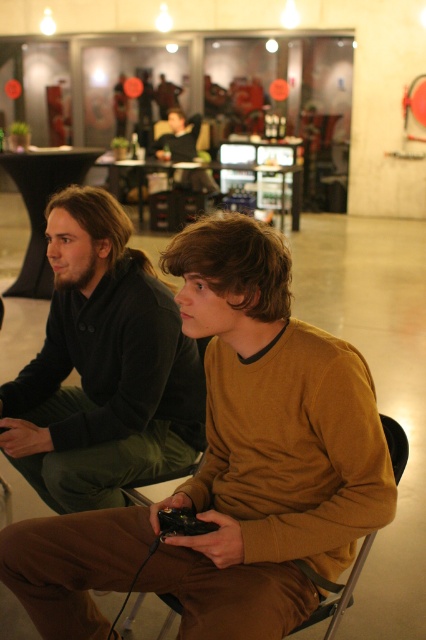
What do you see at coordinates (232, 467) in the screenshot?
I see `brown cotton shirt at center` at bounding box center [232, 467].

Locate an element on the screen. The image size is (426, 640). brown cotton shirt at center is located at coordinates (232, 467).

Between brown matte sweater at center and metallic silver chair at center, which one has less height?

metallic silver chair at center

Locate an element on the screen. The height and width of the screenshot is (640, 426). brown matte sweater at center is located at coordinates (103, 368).

Can you confirm if brown cotton shirt at center is positioned below metallic silver chair at center?

No, brown cotton shirt at center is not below metallic silver chair at center.

In the scene shown: Who is more distant from viewer, (x=287, y=337) or (x=187, y=476)?

The point (x=187, y=476) is behind.

The height and width of the screenshot is (640, 426). What are the coordinates of `brown cotton shirt at center` in the screenshot? It's located at (232, 467).